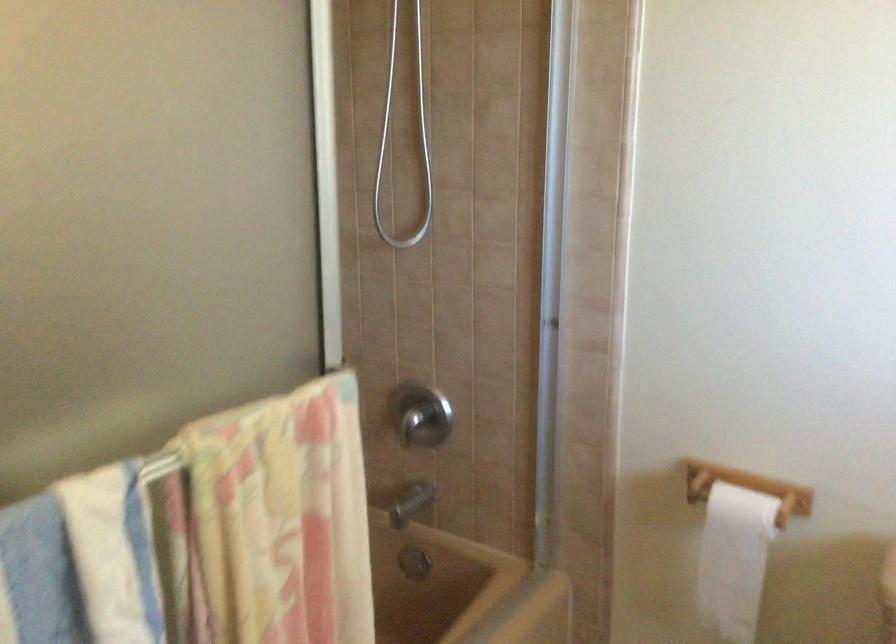
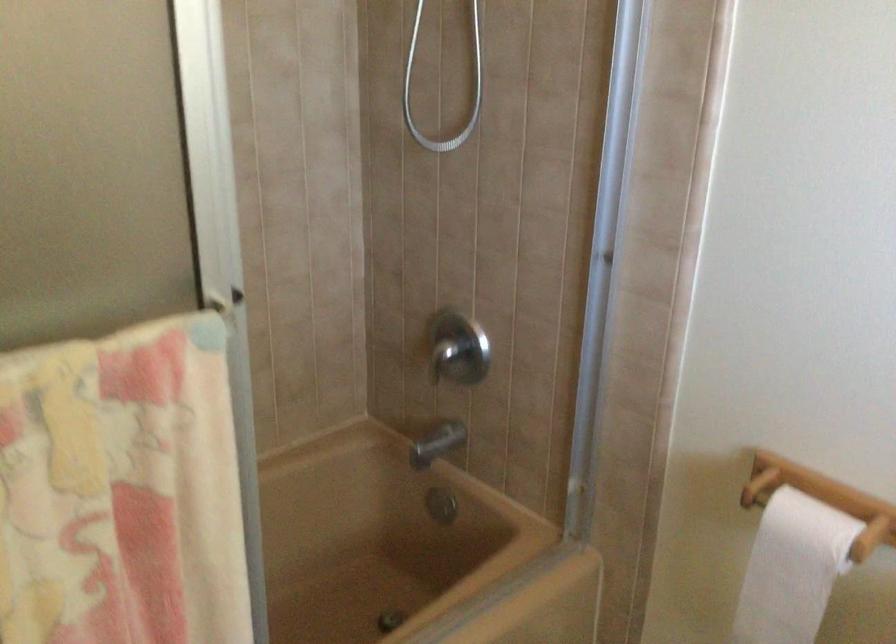
Where in the second image is the point corresponding to [738,544] from the first image?

(791, 569)